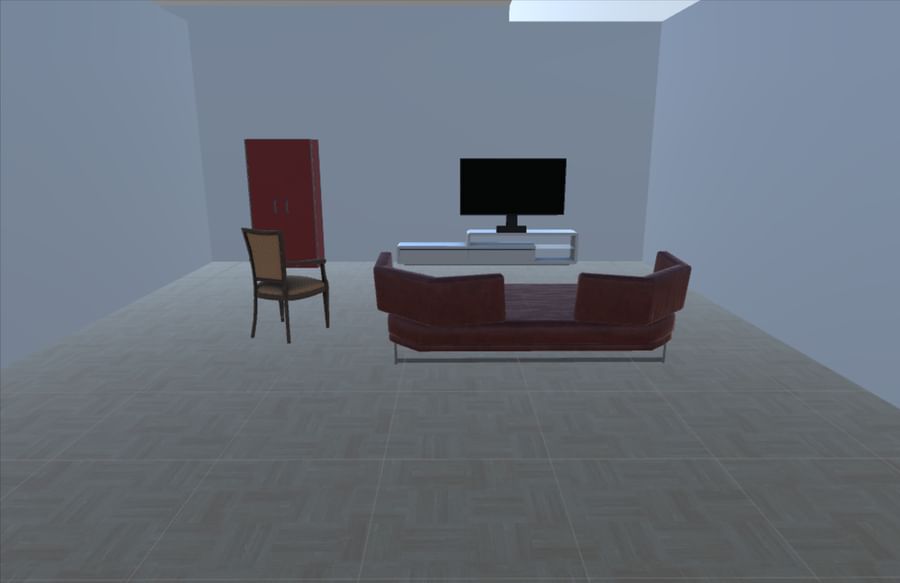
In order to click on television in this screenshot , I will do `click(511, 188)`.